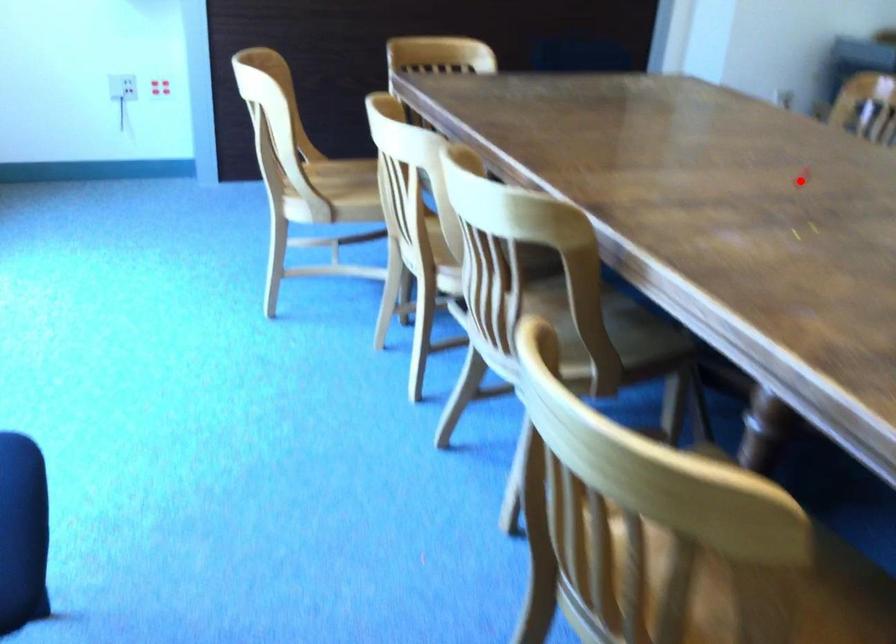
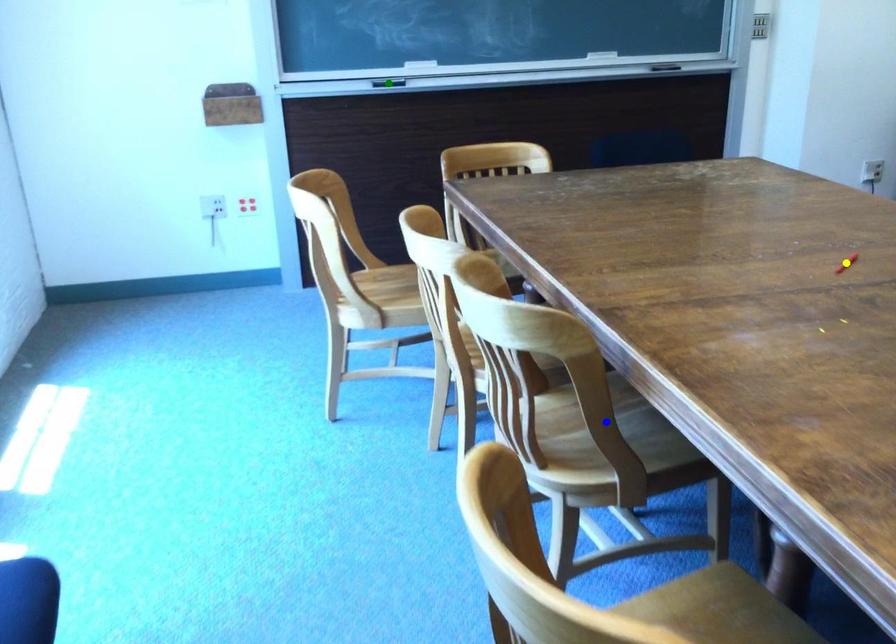
Question: I am providing you with two images of the same scene from different viewpoints. A red point is marked on the first image. You are given multiple points on the second image. Can you choose the point in image 2 that corresponds to the point in image 1?

Choices:
 (A) blue point
 (B) green point
 (C) yellow point

Answer: (C)